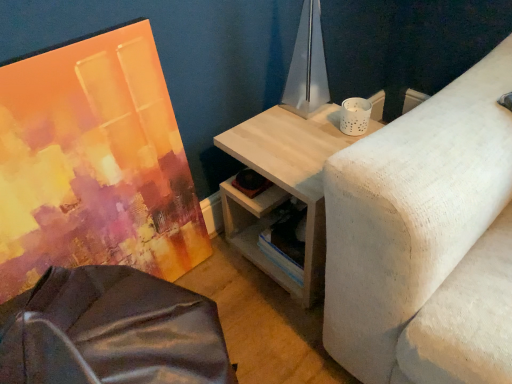
Question: Is matte acrylic painting at left smaller than light wood/texture side table at upper right?

Choices:
 (A) yes
 (B) no

Answer: (A)

Question: Is matte acrylic painting at left shorter than light wood/texture side table at upper right?

Choices:
 (A) yes
 (B) no

Answer: (B)

Question: Considering the relative sizes of matte acrylic painting at left and light wood/texture side table at upper right in the image provided, is matte acrylic painting at left bigger than light wood/texture side table at upper right?

Choices:
 (A) no
 (B) yes

Answer: (A)

Question: Is matte acrylic painting at left further to camera compared to light wood/texture side table at upper right?

Choices:
 (A) no
 (B) yes

Answer: (A)

Question: From the image's perspective, is matte acrylic painting at left on top of light wood/texture side table at upper right?

Choices:
 (A) no
 (B) yes

Answer: (B)

Question: Is matte acrylic painting at left in front of or behind light wood/texture side table at upper right in the image?

Choices:
 (A) behind
 (B) front

Answer: (B)

Question: Considering the relative positions of matte acrylic painting at left and light wood/texture side table at upper right in the image provided, is matte acrylic painting at left to the left or to the right of light wood/texture side table at upper right?

Choices:
 (A) left
 (B) right

Answer: (A)

Question: Is point (78, 168) closer or farther from the camera than point (317, 188)?

Choices:
 (A) farther
 (B) closer

Answer: (A)

Question: Considering the positions of matte acrylic painting at left and light wood/texture side table at upper right in the image, is matte acrylic painting at left wider or thinner than light wood/texture side table at upper right?

Choices:
 (A) thin
 (B) wide

Answer: (A)

Question: Considering the positions of light wood/texture side table at upper right and metallic silver table lamp at upper center in the image, is light wood/texture side table at upper right bigger or smaller than metallic silver table lamp at upper center?

Choices:
 (A) small
 (B) big

Answer: (B)

Question: Choose the correct answer: Is light wood/texture side table at upper right inside metallic silver table lamp at upper center or outside it?

Choices:
 (A) outside
 (B) inside

Answer: (A)

Question: Is light wood/texture side table at upper right in front of or behind metallic silver table lamp at upper center in the image?

Choices:
 (A) front
 (B) behind

Answer: (A)

Question: From a real-world perspective, is light wood/texture side table at upper right physically located above or below metallic silver table lamp at upper center?

Choices:
 (A) above
 (B) below

Answer: (B)

Question: From the image's perspective, is metallic silver table lamp at upper center located above or below light wood/texture side table at upper right?

Choices:
 (A) above
 (B) below

Answer: (A)

Question: Based on their sizes in the image, would you say metallic silver table lamp at upper center is bigger or smaller than light wood/texture side table at upper right?

Choices:
 (A) small
 (B) big

Answer: (A)